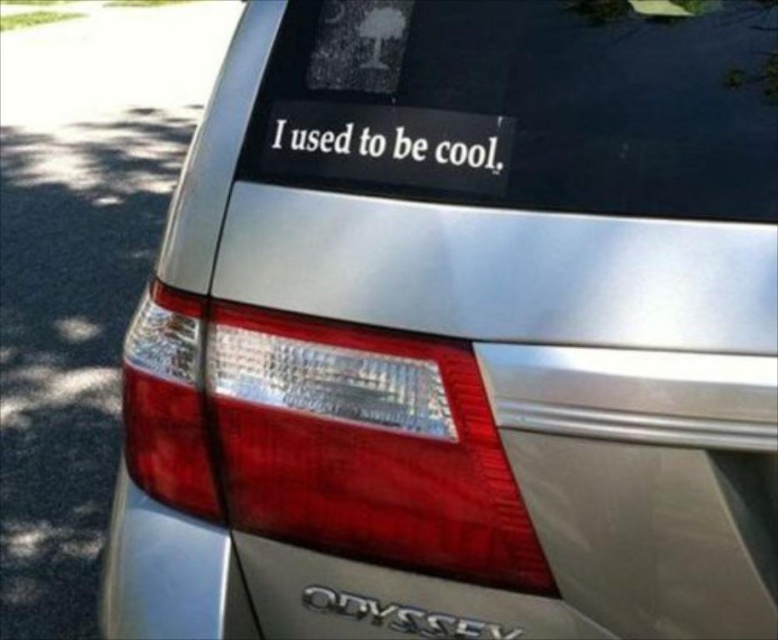
Can you confirm if white matte sticker at center is positioned to the left of black metallic odyssey at lower center?

Indeed, white matte sticker at center is positioned on the left side of black metallic odyssey at lower center.

Is white matte sticker at center positioned at the back of black metallic odyssey at lower center?

No, it is in front of black metallic odyssey at lower center.

Is point (282, 115) positioned before point (359, 611)?

That is False.

Find the location of a particular element. The height and width of the screenshot is (640, 778). white matte sticker at center is located at coordinates [x=389, y=144].